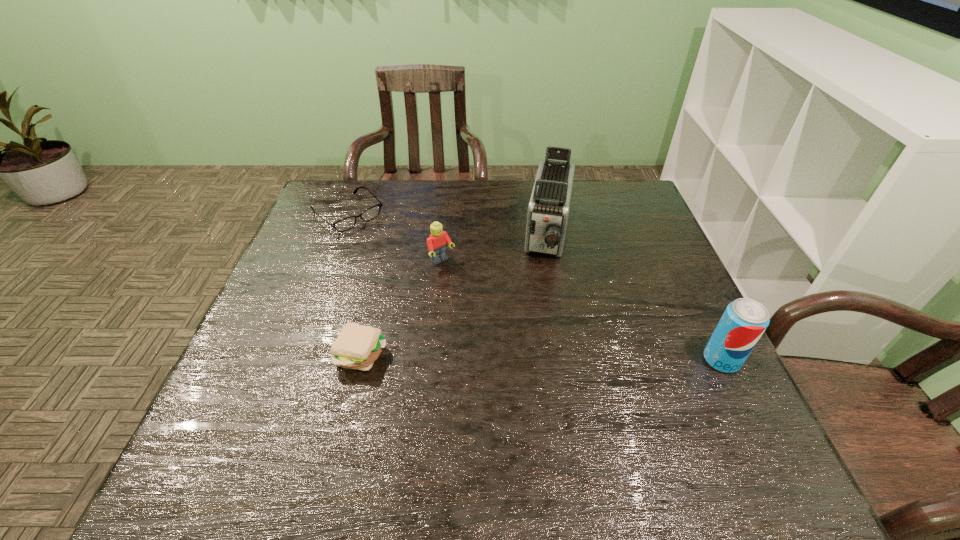
Locate an element on the screen. Image resolution: width=960 pixels, height=540 pixels. free spot on the desktop that is between the patty and the soda can and is positioned on the face of the third object from right to left is located at coordinates (540, 356).

Where is `free spot on the desktop that is between the patty and the rightmost object and is positioned at the lens of the camcorder`? The height and width of the screenshot is (540, 960). free spot on the desktop that is between the patty and the rightmost object and is positioned at the lens of the camcorder is located at coordinates (525, 356).

At what (x,y) coordinates should I click in order to perform the action: click on free space on the desktop that is between the second shortest object and the soda can and is positioned on the front-facing side of the shortest object. Please return your answer as a coordinate pair (x, y). Looking at the image, I should click on (504, 356).